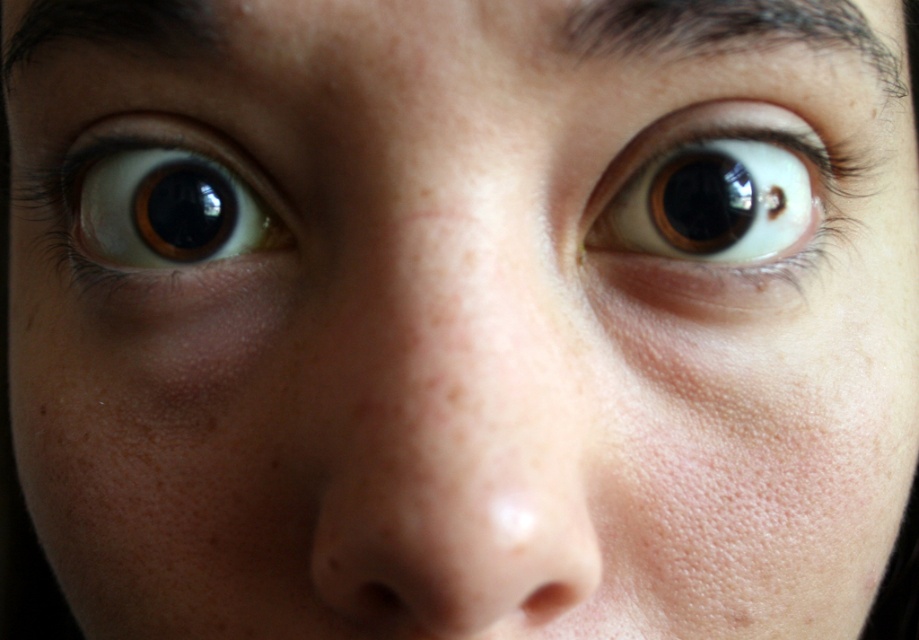
Question: Can you confirm if brown glossy eye at left is wider than dark brown hair at upper center?

Choices:
 (A) yes
 (B) no

Answer: (B)

Question: Estimate the real-world distances between objects in this image. Which object is closer to the dark brown hair at upper center?

Choices:
 (A) brown glossy eye at upper right
 (B) dark brown hair at upper left
 (C) brown glossy eye at left

Answer: (A)

Question: Is brown glossy eye at left positioned behind dark brown hair at upper left?

Choices:
 (A) no
 (B) yes

Answer: (B)

Question: Is the position of brown glossy eye at left more distant than that of dark brown hair at upper center?

Choices:
 (A) no
 (B) yes

Answer: (B)

Question: Based on their relative distances, which object is farther from the dark brown hair at upper left?

Choices:
 (A) brown glossy eye at left
 (B) dark brown hair at upper center
 (C) brown glossy eye at upper right

Answer: (C)

Question: Which object is closer to the camera taking this photo?

Choices:
 (A) brown glossy eye at upper right
 (B) brown glossy eye at left

Answer: (A)